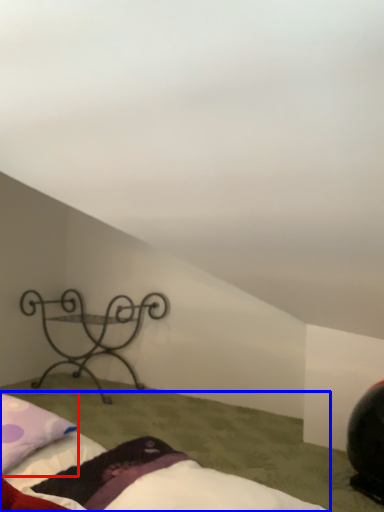
Question: Which object is closer to the camera taking this photo, pillow (highlighted by a red box) or bed (highlighted by a blue box)?

Choices:
 (A) pillow
 (B) bed

Answer: (B)